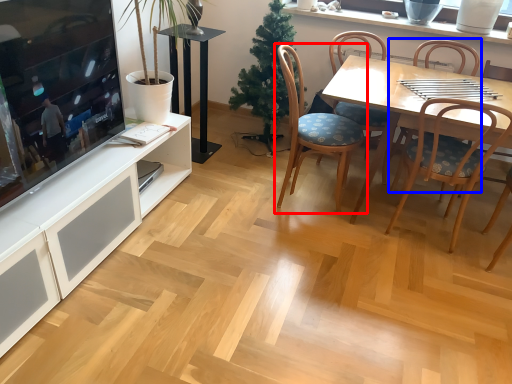
Question: Which object is closer to the camera taking this photo, chair (highlighted by a red box) or chair (highlighted by a blue box)?

Choices:
 (A) chair
 (B) chair

Answer: (A)